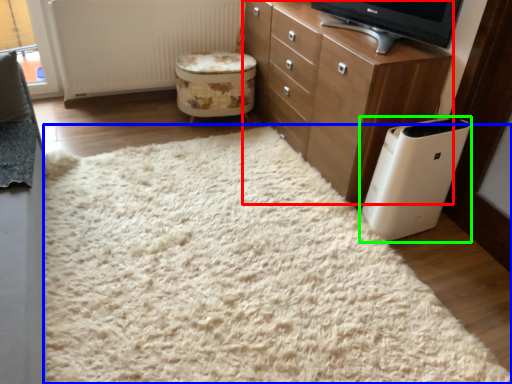
Question: Considering the real-world distances, which object is closest to chest of drawers (highlighted by a red box)? plain (highlighted by a blue box) or home appliance (highlighted by a green box).

Choices:
 (A) plain
 (B) home appliance

Answer: (B)